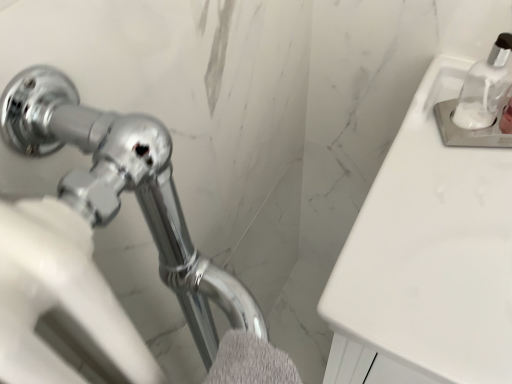
What do you see at coordinates (484, 88) in the screenshot? I see `clear glass soap dispenser at upper right` at bounding box center [484, 88].

What is the approximate width of clear glass soap dispenser at upper right?

clear glass soap dispenser at upper right is 2.35 inches wide.

Describe the element at coordinates (250, 362) in the screenshot. I see `gray fluffy bath towel at lower center` at that location.

The image size is (512, 384). In order to click on clear glass soap dispenser at upper right in this screenshot , I will do `click(484, 88)`.

Are gray fluffy bath towel at lower center and clear glass soap dispenser at upper right beside each other?

No, gray fluffy bath towel at lower center is not touching clear glass soap dispenser at upper right.

Is point (237, 332) positioned in front of point (486, 99)?

Yes.

Which object is closer to the camera taking this photo, gray fluffy bath towel at lower center or clear glass soap dispenser at upper right?

gray fluffy bath towel at lower center is closer to the camera.

Find the location of `bath towel that appears below the clear glass soap dispenser at upper right (from the image's perspective)`. bath towel that appears below the clear glass soap dispenser at upper right (from the image's perspective) is located at coordinates (250, 362).

Based on their sizes in the image, would you say white glossy sink at upper right is bigger or smaller than gray fluffy bath towel at lower center?

white glossy sink at upper right is bigger than gray fluffy bath towel at lower center.

Are white glossy sink at upper right and gray fluffy bath towel at lower center far apart?

That's not correct — white glossy sink at upper right is a little close to gray fluffy bath towel at lower center.

Is white glossy sink at upper right shorter than gray fluffy bath towel at lower center?

Incorrect, the height of white glossy sink at upper right does not fall short of that of gray fluffy bath towel at lower center.

Does white glossy sink at upper right come in front of gray fluffy bath towel at lower center?

No, white glossy sink at upper right is further to the viewer.

Can you confirm if gray fluffy bath towel at lower center is wider than white glossy sink at upper right?

No, gray fluffy bath towel at lower center is not wider than white glossy sink at upper right.

From the image's perspective, is gray fluffy bath towel at lower center positioned above or below white glossy sink at upper right?

Based on their image positions, gray fluffy bath towel at lower center is located beneath white glossy sink at upper right.

Is gray fluffy bath towel at lower center far from white glossy sink at upper right?

Actually, gray fluffy bath towel at lower center and white glossy sink at upper right are a little close together.

At what (x,y) coordinates should I click in order to perform the action: click on counter top behind the gray fluffy bath towel at lower center. Please return your answer as a coordinate pair (x, y). Looking at the image, I should click on (426, 259).

You are a GUI agent. You are given a task and a screenshot of the screen. Output one action in this format:
    pyautogui.click(x=<x>, y=<y>)
    Task: Click on the soap dispenser above the gray fluffy bath towel at lower center (from a real-world perspective)
    The image size is (512, 384).
    Given the screenshot: What is the action you would take?
    pyautogui.click(x=484, y=88)

Looking at this image, from a real-world perspective, is clear glass soap dispenser at upper right positioned above or below gray fluffy bath towel at lower center?

clear glass soap dispenser at upper right is situated higher than gray fluffy bath towel at lower center in the real world.

From the image's perspective, is clear glass soap dispenser at upper right located beneath gray fluffy bath towel at lower center?

No.

Is clear glass soap dispenser at upper right facing towards gray fluffy bath towel at lower center?

No, clear glass soap dispenser at upper right does not turn towards gray fluffy bath towel at lower center.

Does clear glass soap dispenser at upper right have a greater height compared to white glossy sink at upper right?

In fact, clear glass soap dispenser at upper right may be shorter than white glossy sink at upper right.

From a real-world perspective, which is physically above, clear glass soap dispenser at upper right or white glossy sink at upper right?

In real-world perspective, clear glass soap dispenser at upper right is above.

Identify the location of soap dispenser positioned vertically above the white glossy sink at upper right (from a real-world perspective). (484, 88).

Who is bigger, clear glass soap dispenser at upper right or white glossy sink at upper right?

With larger size is white glossy sink at upper right.

Based on their positions, is white glossy sink at upper right located to the left or right of clear glass soap dispenser at upper right?

In the image, white glossy sink at upper right appears on the right side of clear glass soap dispenser at upper right.

Which object is wider, white glossy sink at upper right or clear glass soap dispenser at upper right?

white glossy sink at upper right.

What's the angular difference between white glossy sink at upper right and clear glass soap dispenser at upper right's facing directions?

The angular difference between white glossy sink at upper right and clear glass soap dispenser at upper right is 24 degrees.

Identify the location of bath towel below the clear glass soap dispenser at upper right (from a real-world perspective). (250, 362).

At what (x,y) coordinates should I click in order to perform the action: click on bath towel below the white glossy sink at upper right (from the image's perspective). Please return your answer as a coordinate pair (x, y). The image size is (512, 384). Looking at the image, I should click on (250, 362).

Estimate the real-world distances between objects in this image. Which object is closer to white glossy sink at upper right, clear glass soap dispenser at upper right or gray fluffy bath towel at lower center?

clear glass soap dispenser at upper right lies closer to white glossy sink at upper right than the other object.

Estimate the real-world distances between objects in this image. Which object is closer to clear glass soap dispenser at upper right, gray fluffy bath towel at lower center or white glossy sink at upper right?

Based on the image, white glossy sink at upper right appears to be nearer to clear glass soap dispenser at upper right.

Looking at this image, which object lies nearer to the anchor point clear glass soap dispenser at upper right, white glossy sink at upper right or gray fluffy bath towel at lower center?

Based on the image, white glossy sink at upper right appears to be nearer to clear glass soap dispenser at upper right.

Looking at the image, which one is located further to gray fluffy bath towel at lower center, white glossy sink at upper right or clear glass soap dispenser at upper right?

clear glass soap dispenser at upper right.

From the image, which object appears to be nearer to gray fluffy bath towel at lower center, clear glass soap dispenser at upper right or white glossy sink at upper right?

white glossy sink at upper right is positioned closer to the anchor gray fluffy bath towel at lower center.

From the image, which object appears to be nearer to white glossy sink at upper right, gray fluffy bath towel at lower center or clear glass soap dispenser at upper right?

Among the two, clear glass soap dispenser at upper right is located nearer to white glossy sink at upper right.

You are a GUI agent. You are given a task and a screenshot of the screen. Output one action in this format:
    pyautogui.click(x=<x>, y=<y>)
    Task: Click on the counter top between clear glass soap dispenser at upper right and gray fluffy bath towel at lower center vertically
    
    Given the screenshot: What is the action you would take?
    pyautogui.click(x=426, y=259)